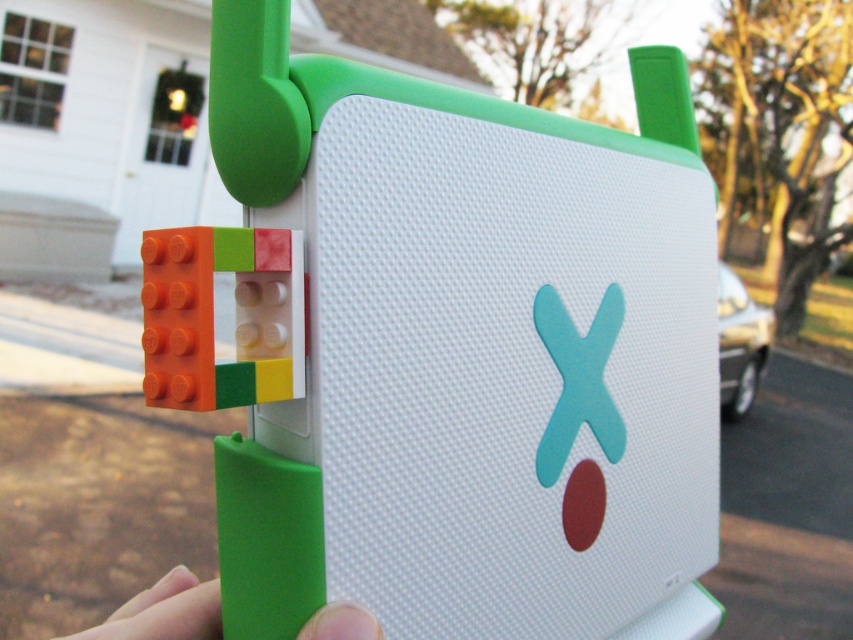
Does point (544, 428) come behind point (155, 582)?

No, it is not.

Who is higher up, matte plastic building blocks at left or green rubber grip at lower center?

Positioned higher is matte plastic building blocks at left.

Is point (656, 340) positioned behind point (328, 634)?

Yes, point (656, 340) is farther from viewer.

I want to click on matte plastic building blocks at left, so click(450, 349).